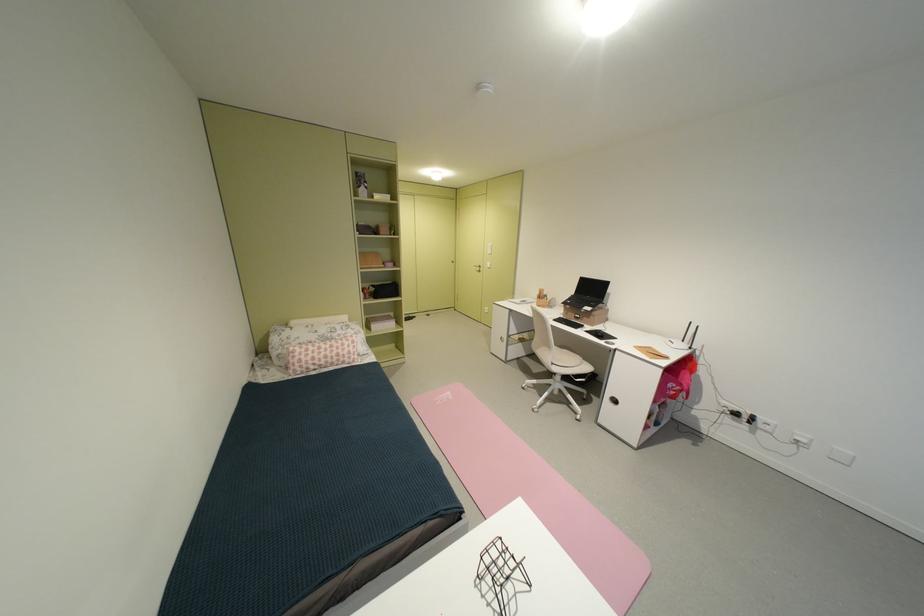
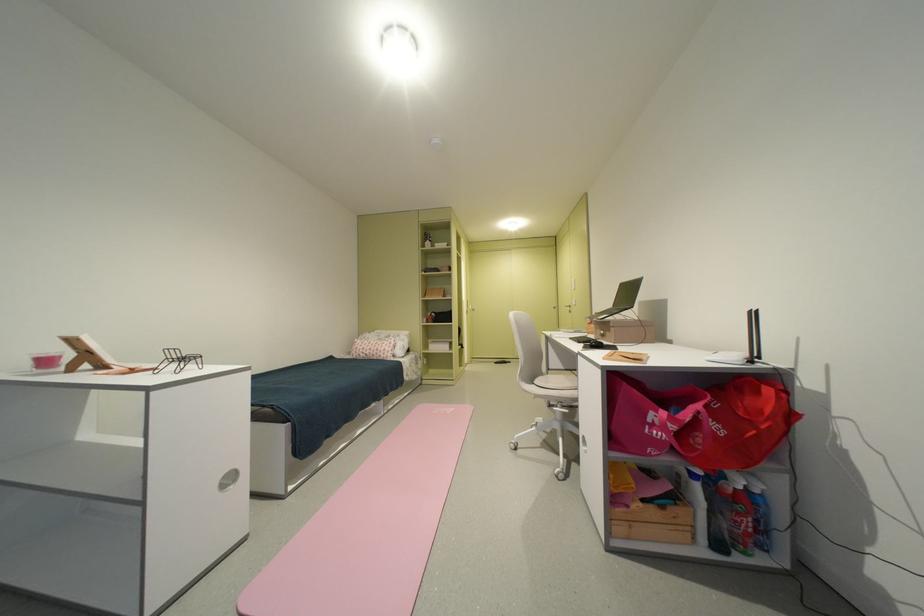
The point at (611, 334) is marked in the first image. Where is the corresponding point in the second image?

(602, 342)